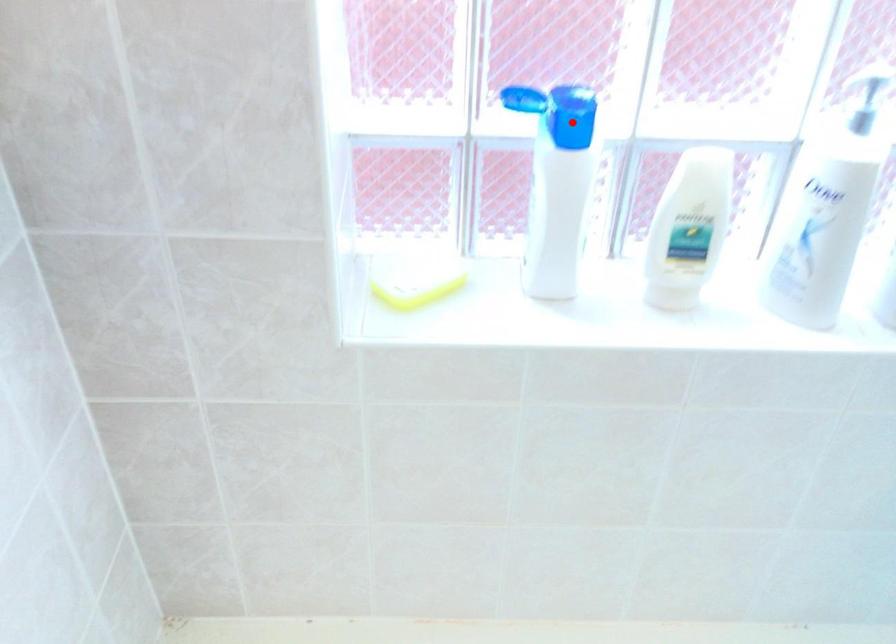
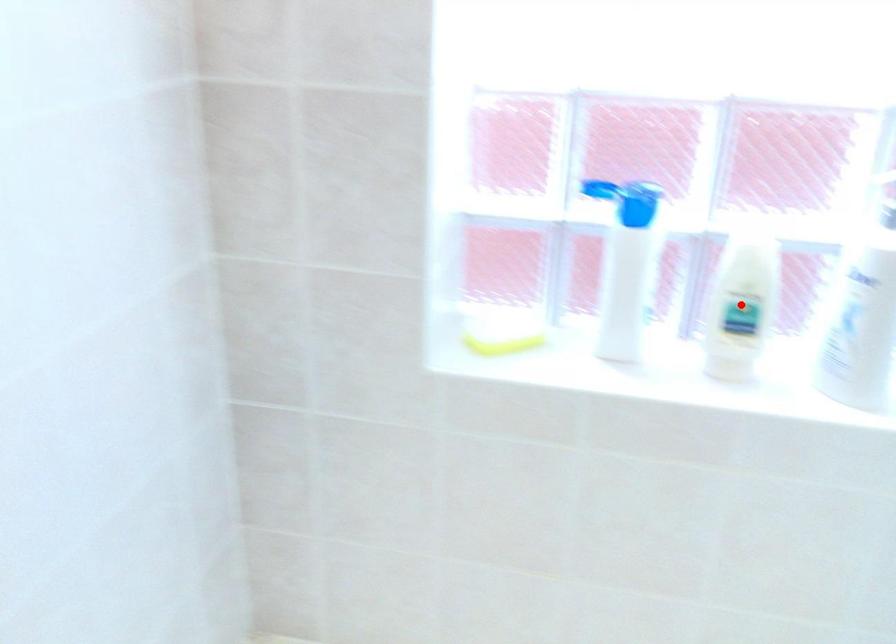
I am providing you with two images of the same scene from different viewpoints. A red point is marked on the first image and another point is marked on the second image. Is the marked point in image1 the same physical position as the marked point in image2?

No